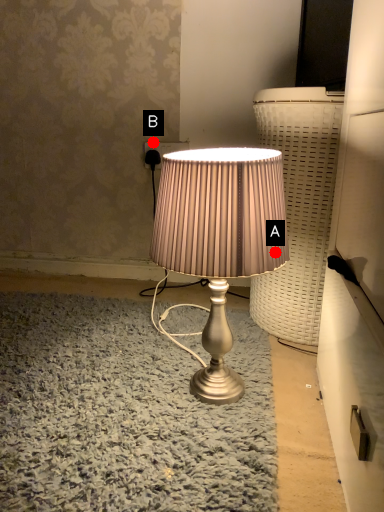
Question: Two points are circled on the image, labeled by A and B beside each circle. Which point is closer to the camera?

Choices:
 (A) A is closer
 (B) B is closer

Answer: (A)